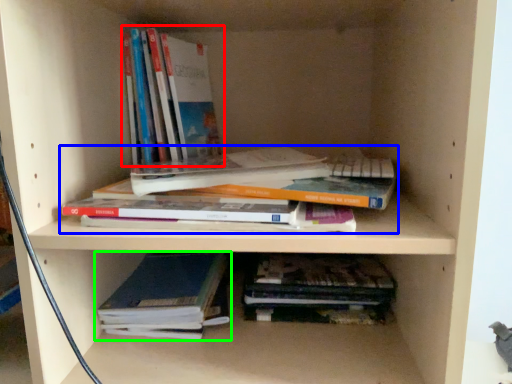
Question: Considering the real-world distances, which object is farthest from book (highlighted by a red box)? book (highlighted by a blue box) or book (highlighted by a green box)?

Choices:
 (A) book
 (B) book

Answer: (B)